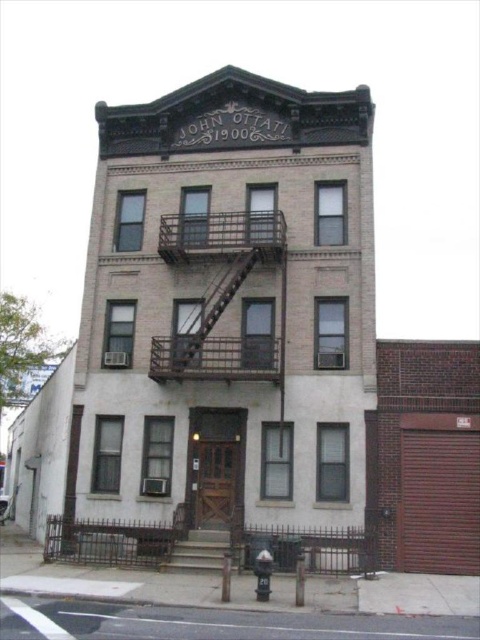
Question: In this image, where is metallic fire escape at center located relative to brown wooden stairs at center?

Choices:
 (A) right
 (B) left

Answer: (A)

Question: Which object appears farthest from the camera in this image?

Choices:
 (A) metallic fire escape at center
 (B) brown wooden stairs at center

Answer: (A)

Question: Is the position of metallic fire escape at center more distant than that of brown wooden stairs at center?

Choices:
 (A) yes
 (B) no

Answer: (A)

Question: Which point appears closest to the camera in this image?

Choices:
 (A) (216, 572)
 (B) (255, 253)

Answer: (A)

Question: In this image, where is metallic fire escape at center located relative to brown wooden stairs at center?

Choices:
 (A) right
 (B) left

Answer: (A)